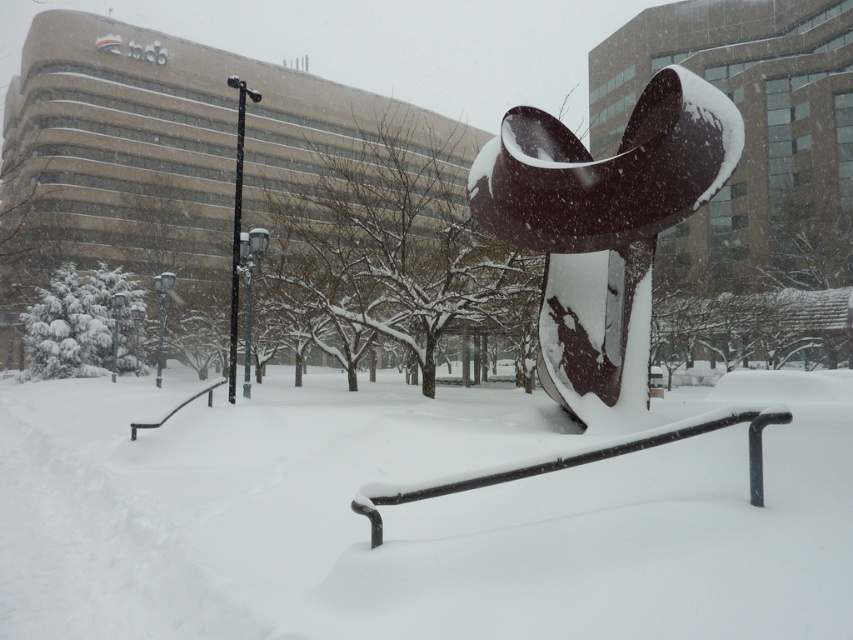
You are standing in the snowy urban scene described. You want to place a small snowman exactly at point (x=477, y=600). If your snowman is 2 meters tall, will it be visible from where you are standing?

The distance of point (x=477, y=600) from viewer is 4.55 meters. Since the snowman is 2 meters tall, it will be visible as the height is sufficient for visibility at that distance.

You are standing in the snowy urban scene and want to walk towards the black metal rail at lower center. However, there is a large sculpture blocking your path. Can you walk around the black polished metal abstract sculpture at center to reach the rail?

The black polished metal abstract sculpture at center is further to the viewer than the black metal rail at lower center, so you can walk around it to reach the rail.

You are an artist planning to photograph the black polished metal abstract sculpture at center and the black metal rail at lower center. Since you want to capture both in a single frame, which object should you position closer to the camera to ensure the sculpture appears larger in the photo?

To ensure the black polished metal abstract sculpture at center appears larger in the photo, position it closer to the camera. Since it is already bigger than the black metal rail at lower center, placing it nearer will emphasize its size relative to the rail.